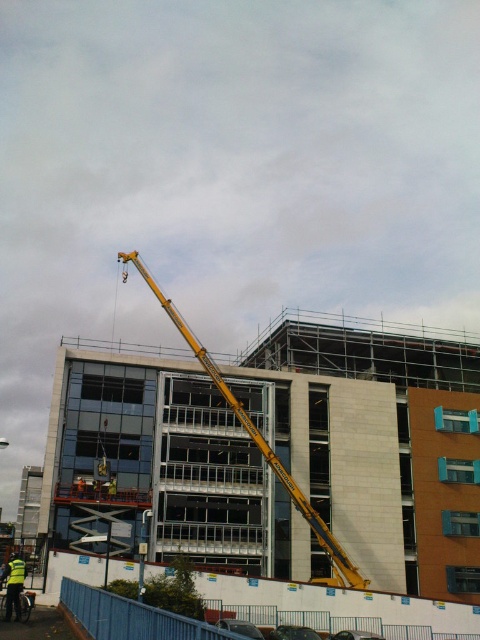
Question: Does yellow metallic crane at center have a larger size compared to yellow reflective vest at lower left?

Choices:
 (A) yes
 (B) no

Answer: (A)

Question: Can you confirm if yellow metallic crane at center is thinner than yellow reflective vest at lower left?

Choices:
 (A) no
 (B) yes

Answer: (A)

Question: Among these points, which one is farthest from the camera?

Choices:
 (A) (346, 579)
 (B) (6, 596)

Answer: (A)

Question: Can you confirm if yellow metallic crane at center is positioned below yellow reflective vest at lower left?

Choices:
 (A) yes
 (B) no

Answer: (B)